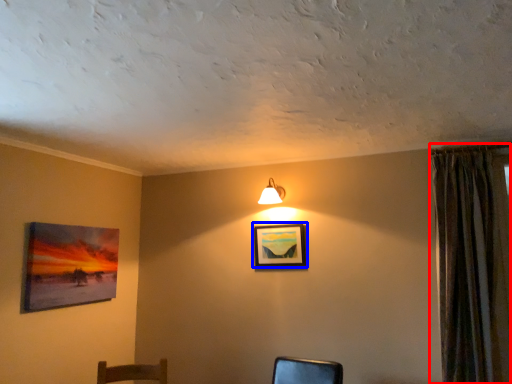
Question: Which point is closer to the camera, curtain (highlighted by a red box) or picture frame (highlighted by a blue box)?

Choices:
 (A) curtain
 (B) picture frame

Answer: (A)